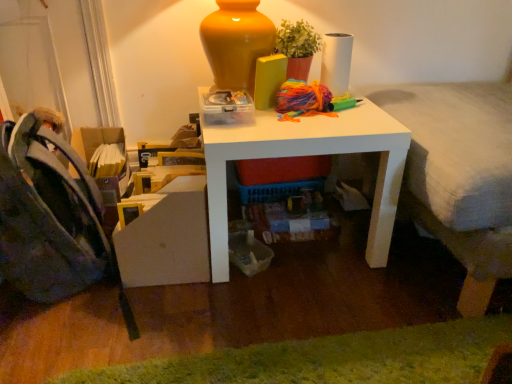
Question: Should I look upward or downward to see matte terracotta pot at upper center?

Choices:
 (A) down
 (B) up

Answer: (B)

Question: Considering the relative sizes of matte terracotta pot at upper center and white matte table at center in the image provided, is matte terracotta pot at upper center wider than white matte table at center?

Choices:
 (A) yes
 (B) no

Answer: (B)

Question: From a real-world perspective, is matte terracotta pot at upper center physically below white matte table at center?

Choices:
 (A) no
 (B) yes

Answer: (A)

Question: From a real-world perspective, is matte terracotta pot at upper center on white matte table at center?

Choices:
 (A) no
 (B) yes

Answer: (B)

Question: From the image's perspective, does matte terracotta pot at upper center appear higher than white matte table at center?

Choices:
 (A) yes
 (B) no

Answer: (A)

Question: Is matte terracotta pot at upper center bigger than white matte table at center?

Choices:
 (A) no
 (B) yes

Answer: (A)

Question: Is matte terracotta pot at upper center thinner than white matte table at center?

Choices:
 (A) yes
 (B) no

Answer: (A)

Question: From the image's perspective, is dark blue fabric folding chair at left under matte terracotta pot at upper center?

Choices:
 (A) yes
 (B) no

Answer: (A)

Question: Does dark blue fabric folding chair at left have a greater width compared to matte terracotta pot at upper center?

Choices:
 (A) yes
 (B) no

Answer: (A)

Question: Is matte terracotta pot at upper center inside dark blue fabric folding chair at left?

Choices:
 (A) no
 (B) yes

Answer: (A)

Question: Is dark blue fabric folding chair at left bigger than matte terracotta pot at upper center?

Choices:
 (A) no
 (B) yes

Answer: (B)

Question: From the image's perspective, is dark blue fabric folding chair at left on top of matte terracotta pot at upper center?

Choices:
 (A) yes
 (B) no

Answer: (B)

Question: From a real-world perspective, is dark blue fabric folding chair at left physically below matte terracotta pot at upper center?

Choices:
 (A) yes
 (B) no

Answer: (A)

Question: Is white matte table at center inside textured gray bed at right?

Choices:
 (A) no
 (B) yes

Answer: (A)